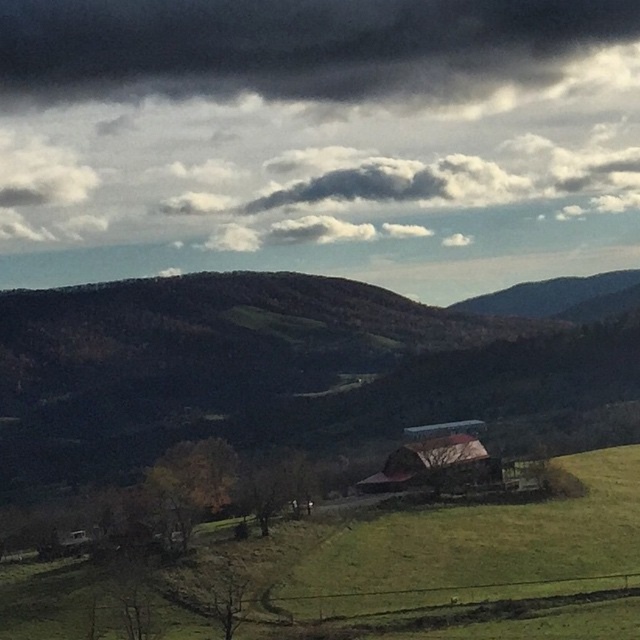
You are standing in the rural landscape scene. There is a dark gray cloud at upper center located at point (298, 48). Is there any object at that point?

Yes, at point (298, 48) there is a dark gray cloud at upper center.